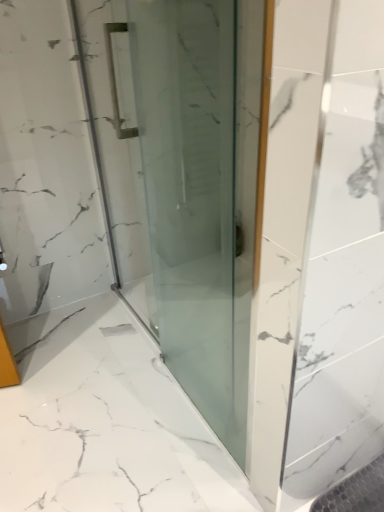
Question: From a real-world perspective, is transparent glass door at center under transparent glass shower at center?

Choices:
 (A) yes
 (B) no

Answer: (B)

Question: Is transparent glass door at center at the right side of transparent glass shower at center?

Choices:
 (A) yes
 (B) no

Answer: (B)

Question: Is transparent glass door at center facing away from transparent glass shower at center?

Choices:
 (A) no
 (B) yes

Answer: (B)

Question: Can you confirm if transparent glass door at center is thinner than transparent glass shower at center?

Choices:
 (A) yes
 (B) no

Answer: (A)

Question: From a real-world perspective, does transparent glass door at center stand above transparent glass shower at center?

Choices:
 (A) yes
 (B) no

Answer: (A)

Question: Is transparent glass door at center with transparent glass shower at center?

Choices:
 (A) yes
 (B) no

Answer: (B)

Question: Is transparent glass shower at center facing towards transparent glass door at center?

Choices:
 (A) yes
 (B) no

Answer: (B)

Question: From the image's perspective, is transparent glass shower at center beneath transparent glass door at center?

Choices:
 (A) yes
 (B) no

Answer: (A)

Question: Is transparent glass shower at center positioned with its back to transparent glass door at center?

Choices:
 (A) no
 (B) yes

Answer: (A)

Question: Does transparent glass shower at center contain transparent glass door at center?

Choices:
 (A) no
 (B) yes

Answer: (A)

Question: Is there a large distance between transparent glass shower at center and transparent glass door at center?

Choices:
 (A) no
 (B) yes

Answer: (A)

Question: Is transparent glass shower at center to the left of transparent glass door at center from the viewer's perspective?

Choices:
 (A) yes
 (B) no

Answer: (B)

Question: Is transparent glass door at center wider or thinner than transparent glass shower at center?

Choices:
 (A) thin
 (B) wide

Answer: (A)